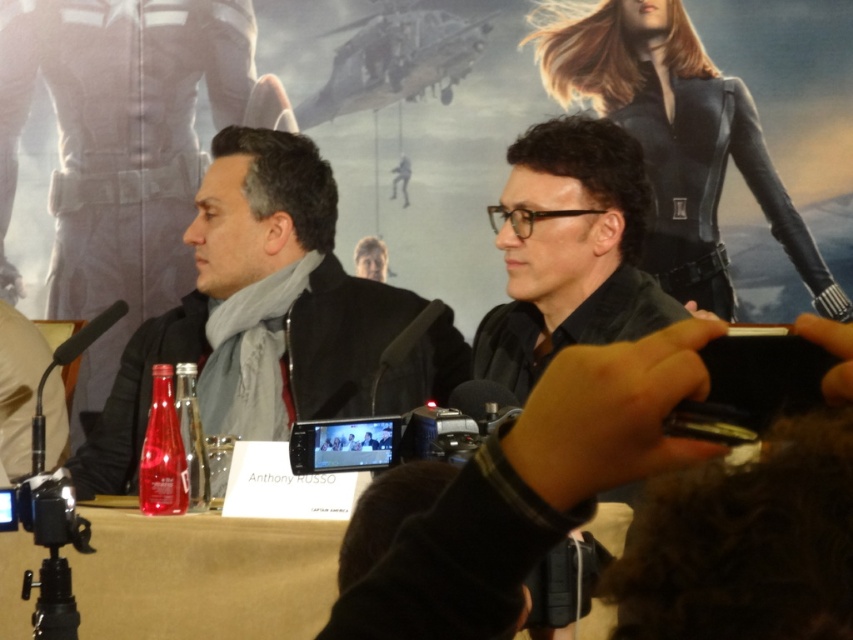
You are a photographer at the event and need to capture a closeup of the black matte microphone at left without including the black matte scarf at left in the frame. Is this possible given their positions?

The black matte scarf at left is to the right of the black matte microphone at left. Since the scarf is positioned to the right of the microphone, you can adjust your camera angle to focus solely on the microphone by moving your camera to the left side of the microphone, ensuring the scarf is out of frame.

You are at the press conference and want to take a photo of both points mentioned. Which point is closer to you, point (x=349, y=371) or point (x=120, y=314)?

Point (x=349, y=371) is further to the viewer than point (x=120, y=314), so point (x=120, y=314) is closer to you.